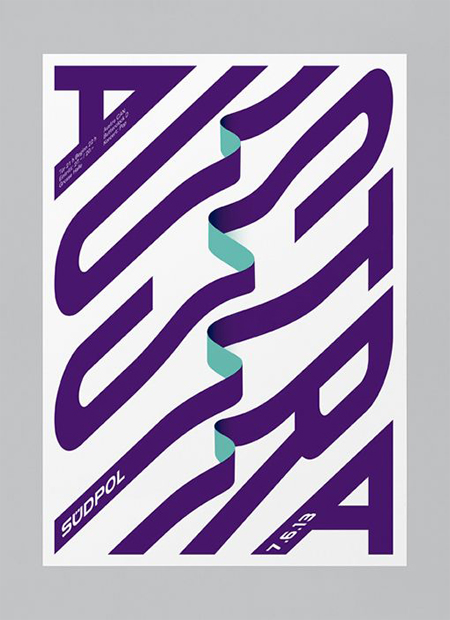
Identify the location of poster for a music and theater venue. (227, 45).